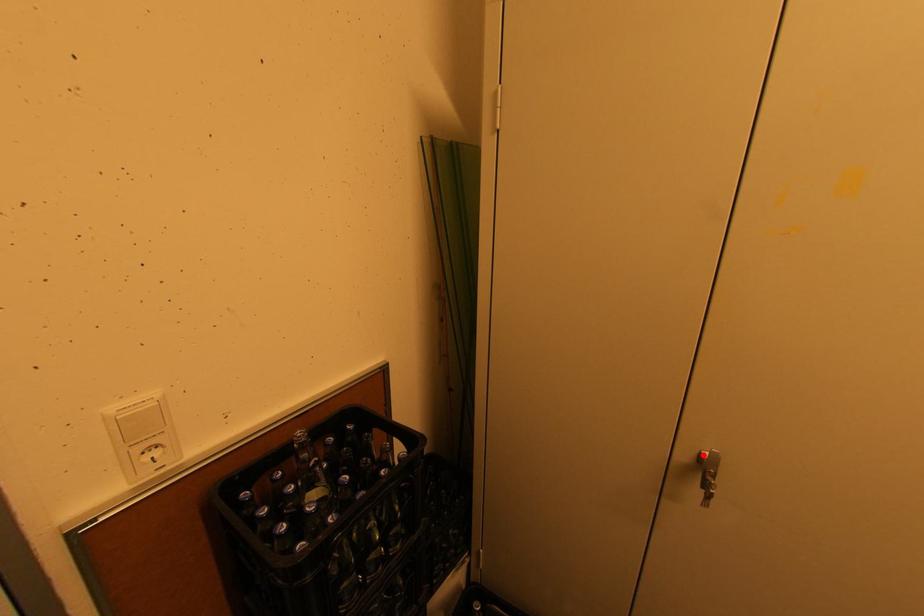
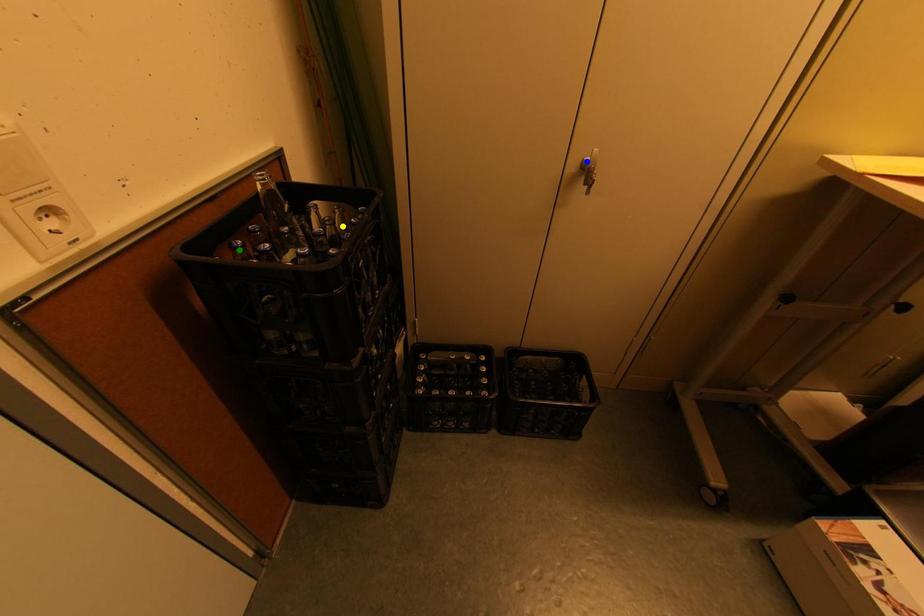
Question: I am providing you with two images of the same scene from different viewpoints. A red point is marked on the first image. You are given multiple points on the second image. Which spot in image 2 lines up with the point in image 1?

Choices:
 (A) blue point
 (B) yellow point
 (C) green point

Answer: (A)